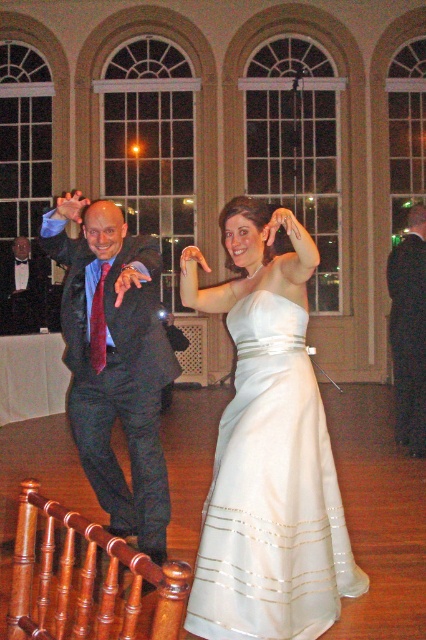
You are a photographer at the wedding reception and need to capture a photo of the matte white dress at center and the matte black suit at center. Based on their positions, which one is closer to the camera?

The matte white dress at center is positioned under the matte black suit at center, so the matte black suit at center is closer to the camera.